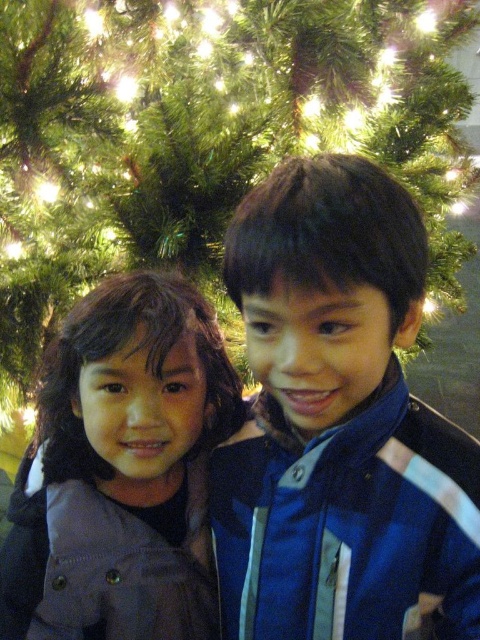
Can you confirm if green textured fir tree at upper center is wider than blue fabric jacket at center?

Yes.

Which is behind, point (113, 97) or point (459, 486)?

Positioned behind is point (113, 97).

You are a GUI agent. You are given a task and a screenshot of the screen. Output one action in this format:
    pyautogui.click(x=<x>, y=<y>)
    Task: Click on the green textured fir tree at upper center
    This screenshot has height=640, width=480.
    Given the screenshot: What is the action you would take?
    pyautogui.click(x=207, y=140)

Is point (73, 188) behind point (117, 460)?

Yes, it is.

Is green textured fir tree at upper center positioned in front of matte gray jacket at center?

No, it is not.

Is point (37, 346) positioned after point (214, 392)?

Yes, it is.

Identify the location of green textured fir tree at upper center. (207, 140).

Between blue fabric jacket at center and matte gray jacket at center, which one appears on the left side from the viewer's perspective?

Positioned to the left is matte gray jacket at center.

Is point (394, 609) in front of point (192, 609)?

Yes.

Find the location of `blue fabric jacket at center`. blue fabric jacket at center is located at coordinates (339, 424).